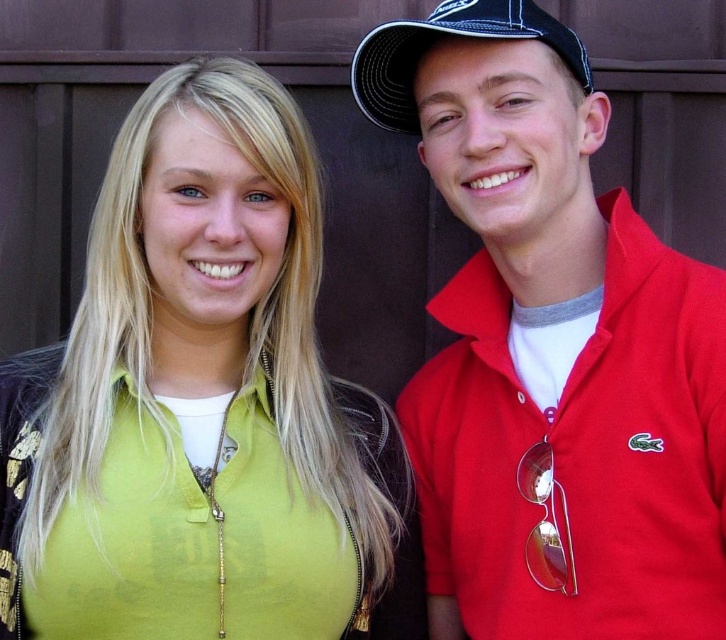
Question: Which point appears closest to the camera in this image?

Choices:
 (A) (587, 83)
 (B) (106, 461)
 (C) (650, 616)

Answer: (C)

Question: Which point is closer to the camera?

Choices:
 (A) black mesh baseball cap at upper right
 (B) matte red polo shirt at right
 (C) green matte shirt at center

Answer: (C)

Question: Where is green matte shirt at center located in relation to matte red polo shirt at right in the image?

Choices:
 (A) below
 (B) above

Answer: (A)

Question: Which point appears farthest from the camera in this image?

Choices:
 (A) (440, 26)
 (B) (184, 541)
 (C) (644, 234)

Answer: (C)

Question: Does green matte shirt at center appear over black mesh baseball cap at upper right?

Choices:
 (A) no
 (B) yes

Answer: (A)

Question: Can you confirm if green matte shirt at center is positioned above matte red polo shirt at right?

Choices:
 (A) no
 (B) yes

Answer: (A)